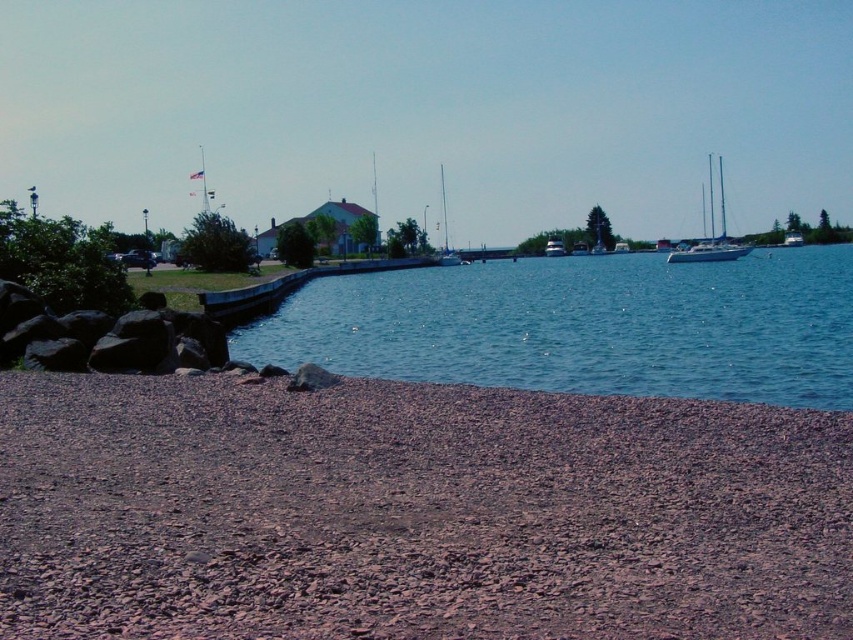
Question: Among these points, which one is nearest to the camera?

Choices:
 (A) (798, 356)
 (B) (799, 234)
 (C) (444, 225)
 (D) (793, 468)

Answer: (D)

Question: Can you confirm if white glossy sailboat at center is positioned to the right of white glossy sailboat at center-right?

Choices:
 (A) yes
 (B) no

Answer: (B)

Question: Which is nearer to the white glossy sailboat at upper right?

Choices:
 (A) brown gravel beach at lower left
 (B) white glossy sailboat at center
 (C) blue water at center
 (D) green plastic boat at center

Answer: (C)

Question: Is the position of brown gravel beach at lower left less distant than that of blue water at center?

Choices:
 (A) no
 (B) yes

Answer: (B)

Question: Is white glossy sailboat at upper right wider than white glossy sailboat at center-right?

Choices:
 (A) yes
 (B) no

Answer: (A)

Question: Which point appears farthest from the camera in this image?

Choices:
 (A) (283, 509)
 (B) (699, 248)

Answer: (B)